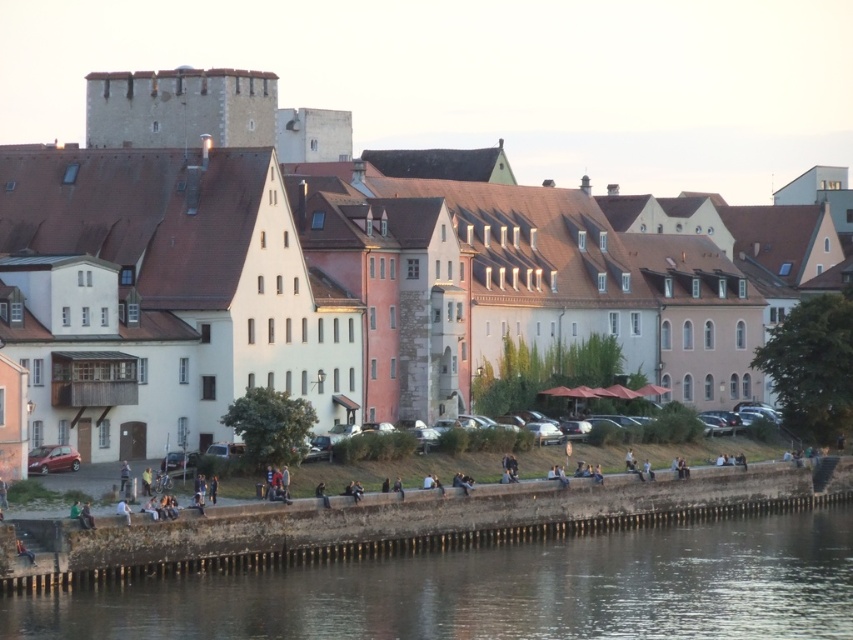
You are planning to take a photo of both the white stone buildings at center and the smooth concrete wall at lower center. Since you want both to be fully visible in the frame, which object should you prioritize positioning closer to the camera to ensure it doesn

The white stone buildings at center are wider than the smooth concrete wall at lower center. To ensure both are fully visible in the photo, prioritize positioning the white stone buildings at center closer to the camera so that its width fits within the frame while still capturing the smooth concrete wall at lower center in the background.

You are standing on the grassy area near the smooth concrete wall at lower center and want to take a photo of the white stone buildings at center. Which direction should you face to capture them in your shot?

You should face away from the smooth concrete wall at lower center because the white stone buildings at center is positioned over it, meaning they are located behind the wall from your current position.